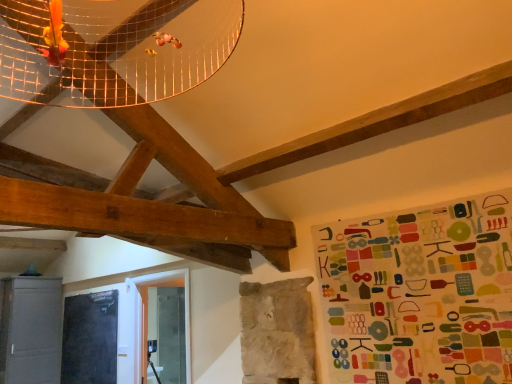
Question: Is matte gray cabinet at lower left positioned before black matte bulletin board at lower left?

Choices:
 (A) yes
 (B) no

Answer: (B)

Question: From a real-world perspective, is matte gray cabinet at lower left physically below black matte bulletin board at lower left?

Choices:
 (A) no
 (B) yes

Answer: (A)

Question: Is matte gray cabinet at lower left oriented towards black matte bulletin board at lower left?

Choices:
 (A) yes
 (B) no

Answer: (A)

Question: From a real-world perspective, is matte gray cabinet at lower left positioned over black matte bulletin board at lower left based on gravity?

Choices:
 (A) yes
 (B) no

Answer: (A)

Question: Is black matte bulletin board at lower left completely or partially inside matte gray cabinet at lower left?

Choices:
 (A) no
 (B) yes

Answer: (A)

Question: Is matte gray cabinet at lower left oriented away from black matte bulletin board at lower left?

Choices:
 (A) yes
 (B) no

Answer: (B)

Question: Does black matte bulletin board at lower left have a lesser height compared to matte gray cabinet at lower left?

Choices:
 (A) yes
 (B) no

Answer: (A)

Question: Is black matte bulletin board at lower left directly adjacent to matte gray cabinet at lower left?

Choices:
 (A) yes
 (B) no

Answer: (B)

Question: From a real-world perspective, is black matte bulletin board at lower left on matte gray cabinet at lower left?

Choices:
 (A) yes
 (B) no

Answer: (B)

Question: Is matte gray cabinet at lower left a part of black matte bulletin board at lower left?

Choices:
 (A) no
 (B) yes

Answer: (A)

Question: Is black matte bulletin board at lower left not within matte gray cabinet at lower left?

Choices:
 (A) yes
 (B) no

Answer: (A)

Question: Is black matte bulletin board at lower left thinner than matte gray cabinet at lower left?

Choices:
 (A) yes
 (B) no

Answer: (A)

Question: Considering the positions of black matte bulletin board at lower left and matte gray cabinet at lower left in the image, is black matte bulletin board at lower left wider or thinner than matte gray cabinet at lower left?

Choices:
 (A) wide
 (B) thin

Answer: (B)